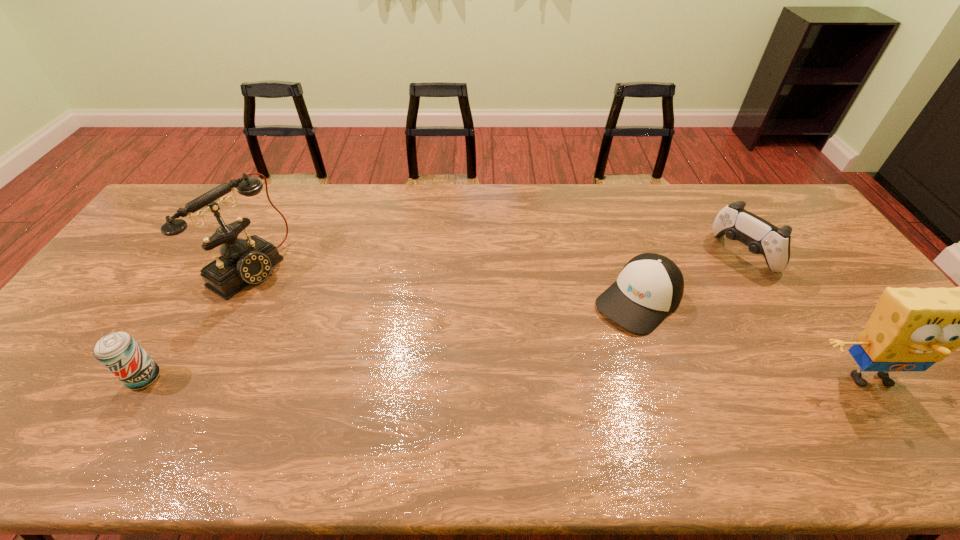
This screenshot has width=960, height=540. In order to click on free space on the desktop that is between the beer can and the sponge and is positioned on the front panel of the cap in this screenshot , I will do 555,378.

What are the coordinates of `vacant spot on the desktop that is between the beer can and the sponge and is positioned on the front-facing side of the control` in the screenshot? It's located at (561, 378).

You are a GUI agent. You are given a task and a screenshot of the screen. Output one action in this format:
    pyautogui.click(x=<x>, y=<y>)
    Task: Click on the free space on the desktop that is between the beer can and the sponge and is positioned on the dial of the telephone
    This screenshot has height=540, width=960.
    Given the screenshot: What is the action you would take?
    pyautogui.click(x=441, y=378)